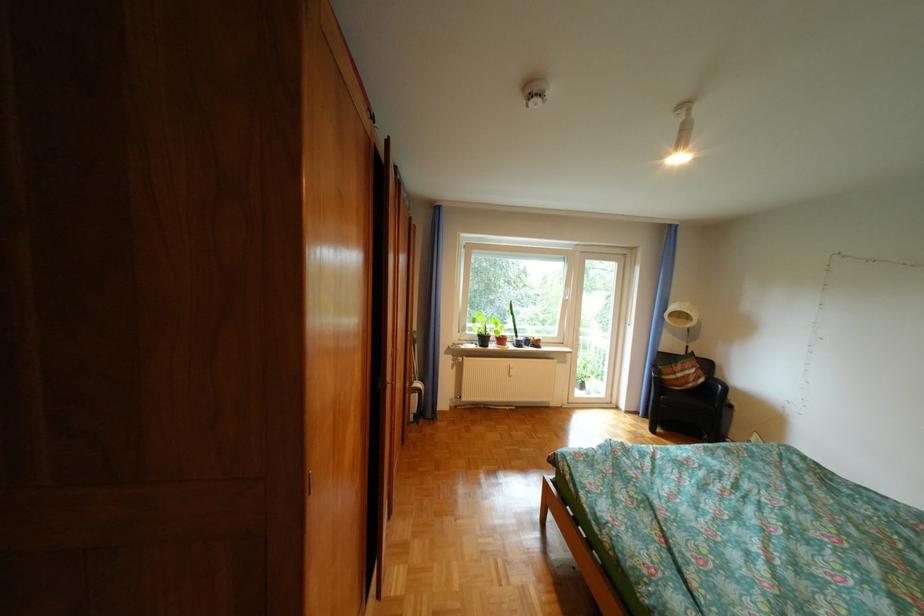
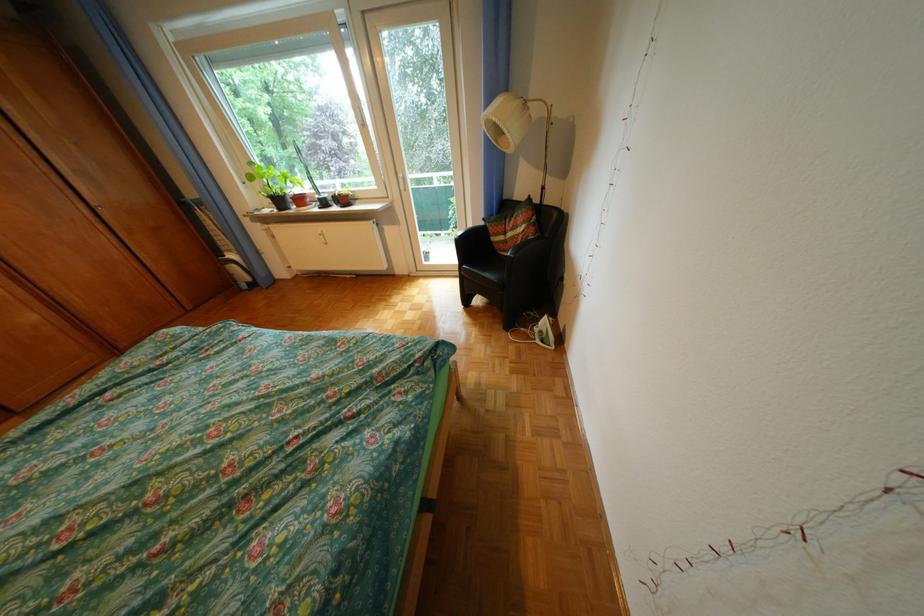
Find the pixel in the second image that matches [695,376] in the first image.

(524, 236)